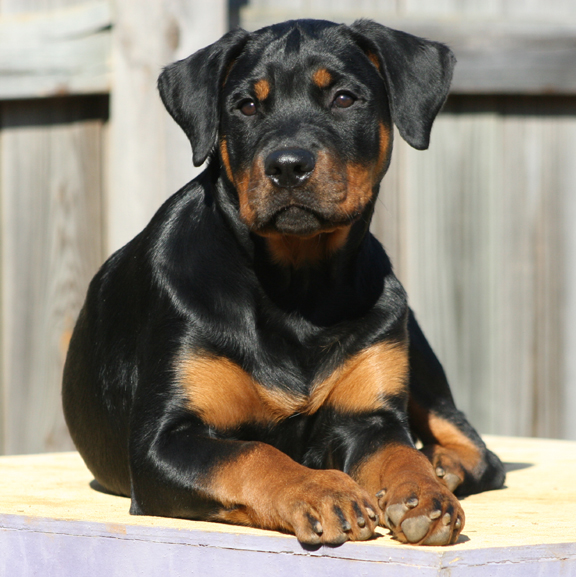
Image resolution: width=576 pixels, height=577 pixels. I want to click on wooden structure, so click(464, 550).